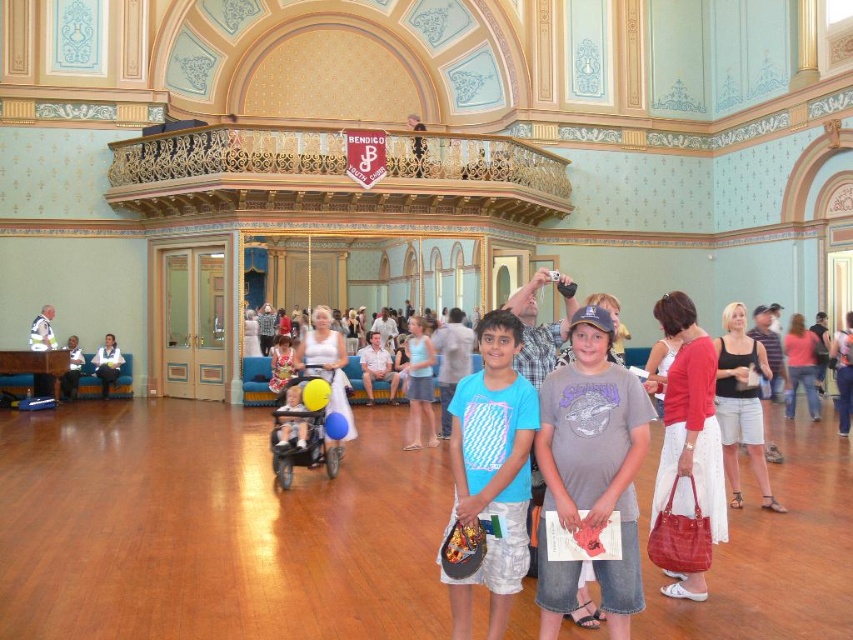
Question: Can you confirm if blue cotton shirt at center is thinner than white shirt at lower left?

Choices:
 (A) yes
 (B) no

Answer: (B)

Question: Considering the relative positions of blue cotton shirt at center and white shirt at lower left in the image provided, where is blue cotton shirt at center located with respect to white shirt at lower left?

Choices:
 (A) right
 (B) left

Answer: (A)

Question: Which of the following is the farthest from the observer?

Choices:
 (A) white shirt at lower left
 (B) matte plastic baby carriage at center
 (C) matte black jacket at left
 (D) blue cotton shirt at center

Answer: (C)

Question: Can you confirm if matte plastic baby carriage at center is wider than matte black jacket at left?

Choices:
 (A) yes
 (B) no

Answer: (B)

Question: Which object is the farthest from the matte plastic baby carriage at center?

Choices:
 (A) white shirt at lower left
 (B) blue cotton shirt at center

Answer: (A)

Question: Which object is the farthest from the matte plastic baby carriage at center?

Choices:
 (A) matte black jacket at left
 (B) white shirt at lower left
 (C) blue cotton shirt at center

Answer: (B)